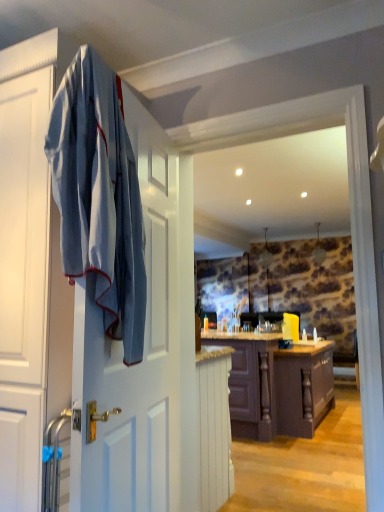
The height and width of the screenshot is (512, 384). Describe the element at coordinates (276, 386) in the screenshot. I see `dark wood cabinet at center, the second cabinetry positioned from the left` at that location.

Image resolution: width=384 pixels, height=512 pixels. What do you see at coordinates (214, 426) in the screenshot?
I see `white painted wood cabinet at lower center, arranged as the 2th cabinetry when viewed from the right` at bounding box center [214, 426].

Locate an element on the screen. This screenshot has height=512, width=384. blue cotton bath towel at left is located at coordinates (99, 196).

Looking at this image, considering the sizes of blue cotton bath towel at left and dark wood cabinet at center, the second cabinetry positioned from the left, in the image, is blue cotton bath towel at left bigger or smaller than dark wood cabinet at center, the second cabinetry positioned from the left,?

In the image, blue cotton bath towel at left appears to be smaller than dark wood cabinet at center, the second cabinetry positioned from the left.

From the image's perspective, count 2nd cabinetrys downward from the blue cotton bath towel at left and point to it. Please provide its 2D coordinates.

[(276, 386)]

How distant is blue cotton bath towel at left from dark wood cabinet at center, the 1th cabinetry in the back-to-front sequence?

The distance of blue cotton bath towel at left from dark wood cabinet at center, the 1th cabinetry in the back-to-front sequence, is 9.47 feet.

From a real-world perspective, who is located lower, blue cotton bath towel at left or dark wood cabinet at center, the second cabinetry positioned from the left?

In real-world perspective, dark wood cabinet at center, the second cabinetry positioned from the left, is lower.

From a real-world perspective, is dark wood cabinet at center, the 1th cabinetry when ordered from right to left, physically located above or below white painted wood cabinet at lower center, arranged as the 2th cabinetry when viewed from the right?

From a real-world perspective, dark wood cabinet at center, the 1th cabinetry when ordered from right to left, is physically above white painted wood cabinet at lower center, arranged as the 2th cabinetry when viewed from the right.

Between dark wood cabinet at center, the 1th cabinetry in the back-to-front sequence, and white painted wood cabinet at lower center, the 1th cabinetry from the front, which one has smaller width?

white painted wood cabinet at lower center, the 1th cabinetry from the front, is thinner.

Is dark wood cabinet at center, the 1th cabinetry when ordered from right to left, not close to white painted wood cabinet at lower center, arranged as the 2th cabinetry when viewed from the right?

Yes.

Where is `cabinetry on the left of dark wood cabinet at center, the 1th cabinetry when ordered from right to left`? cabinetry on the left of dark wood cabinet at center, the 1th cabinetry when ordered from right to left is located at coordinates (214, 426).

You are a GUI agent. You are given a task and a screenshot of the screen. Output one action in this format:
    pyautogui.click(x=<x>, y=<y>)
    Task: Click on the bath towel to the left of dark wood cabinet at center, marked as the 2th cabinetry in a front-to-back arrangement
    This screenshot has width=384, height=512.
    Given the screenshot: What is the action you would take?
    pyautogui.click(x=99, y=196)

Considering the sizes of dark wood cabinet at center, marked as the 2th cabinetry in a front-to-back arrangement, and blue cotton bath towel at left in the image, is dark wood cabinet at center, marked as the 2th cabinetry in a front-to-back arrangement, wider or thinner than blue cotton bath towel at left?

In the image, dark wood cabinet at center, marked as the 2th cabinetry in a front-to-back arrangement, appears to be wider than blue cotton bath towel at left.

Is white painted wood cabinet at lower center, the first cabinetry when ordered from left to right, not close to blue cotton bath towel at left?

Indeed, white painted wood cabinet at lower center, the first cabinetry when ordered from left to right, is not near blue cotton bath towel at left.

You are a GUI agent. You are given a task and a screenshot of the screen. Output one action in this format:
    pyautogui.click(x=<x>, y=<y>)
    Task: Click on the 1st cabinetry behind the blue cotton bath towel at left
    Image resolution: width=384 pixels, height=512 pixels.
    Given the screenshot: What is the action you would take?
    pyautogui.click(x=214, y=426)

Between white painted wood cabinet at lower center, the 1th cabinetry from the front, and blue cotton bath towel at left, which one has smaller width?

With smaller width is white painted wood cabinet at lower center, the 1th cabinetry from the front.

Is blue cotton bath towel at left at the back of white painted wood cabinet at lower center, arranged as the 2th cabinetry when viewed from the back?

No.

Is white painted wood cabinet at lower center, the first cabinetry when ordered from left to right, positioned with its back to dark wood cabinet at center, the 1th cabinetry in the back-to-front sequence?

white painted wood cabinet at lower center, the first cabinetry when ordered from left to right, is not turned away from dark wood cabinet at center, the 1th cabinetry in the back-to-front sequence.

You are a GUI agent. You are given a task and a screenshot of the screen. Output one action in this format:
    pyautogui.click(x=<x>, y=<y>)
    Task: Click on the cabinetry above the dark wood cabinet at center, the 1th cabinetry in the back-to-front sequence (from the image's perspective)
    
    Given the screenshot: What is the action you would take?
    pyautogui.click(x=214, y=426)

Can you confirm if white painted wood cabinet at lower center, the first cabinetry when ordered from left to right, is shorter than dark wood cabinet at center, the second cabinetry positioned from the left?

Correct, white painted wood cabinet at lower center, the first cabinetry when ordered from left to right, is not as tall as dark wood cabinet at center, the second cabinetry positioned from the left.

How different are the orientations of white painted wood cabinet at lower center, arranged as the 2th cabinetry when viewed from the back, and dark wood cabinet at center, the 1th cabinetry when ordered from right to left, in degrees?

0.555 degrees separate the facing orientations of white painted wood cabinet at lower center, arranged as the 2th cabinetry when viewed from the back, and dark wood cabinet at center, the 1th cabinetry when ordered from right to left.

Is blue cotton bath towel at left aimed at white painted wood cabinet at lower center, the first cabinetry when ordered from left to right?

No, blue cotton bath towel at left is not aimed at white painted wood cabinet at lower center, the first cabinetry when ordered from left to right.

Is point (58, 131) closer or farther from the camera than point (213, 434)?

Point (58, 131).

Which object is wider, blue cotton bath towel at left or white painted wood cabinet at lower center, arranged as the 2th cabinetry when viewed from the back?

blue cotton bath towel at left is wider.

Is blue cotton bath towel at left far away from white painted wood cabinet at lower center, the 1th cabinetry from the front?

Absolutely, blue cotton bath towel at left is distant from white painted wood cabinet at lower center, the 1th cabinetry from the front.

Identify the location of the 2nd cabinetry behind the blue cotton bath towel at left. (276, 386).

At what (x,y) coordinates should I click in order to perform the action: click on cabinetry lying below the white painted wood cabinet at lower center, arranged as the 2th cabinetry when viewed from the back (from the image's perspective). Please return your answer as a coordinate pair (x, y). The image size is (384, 512). Looking at the image, I should click on (276, 386).

When comparing their distances from white painted wood cabinet at lower center, arranged as the 2th cabinetry when viewed from the right, does blue cotton bath towel at left or dark wood cabinet at center, the 1th cabinetry in the back-to-front sequence, seem further?

Based on the image, blue cotton bath towel at left appears to be further to white painted wood cabinet at lower center, arranged as the 2th cabinetry when viewed from the right.

Looking at the image, which one is located further to blue cotton bath towel at left, white painted wood cabinet at lower center, the first cabinetry when ordered from left to right, or dark wood cabinet at center, the second cabinetry positioned from the left?

dark wood cabinet at center, the second cabinetry positioned from the left.

Which object lies further to the anchor point dark wood cabinet at center, marked as the 2th cabinetry in a front-to-back arrangement, blue cotton bath towel at left or white painted wood cabinet at lower center, the first cabinetry when ordered from left to right?

blue cotton bath towel at left.

Based on their spatial positions, is white painted wood cabinet at lower center, arranged as the 2th cabinetry when viewed from the back, or blue cotton bath towel at left closer to dark wood cabinet at center, the 1th cabinetry in the back-to-front sequence?

white painted wood cabinet at lower center, arranged as the 2th cabinetry when viewed from the back, lies closer to dark wood cabinet at center, the 1th cabinetry in the back-to-front sequence, than the other object.

Estimate the real-world distances between objects in this image. Which object is further from blue cotton bath towel at left, dark wood cabinet at center, the 1th cabinetry in the back-to-front sequence, or white painted wood cabinet at lower center, the 1th cabinetry from the front?

dark wood cabinet at center, the 1th cabinetry in the back-to-front sequence, lies further to blue cotton bath towel at left than the other object.

Considering their positions, is dark wood cabinet at center, the second cabinetry positioned from the left, positioned further to white painted wood cabinet at lower center, arranged as the 2th cabinetry when viewed from the right, than blue cotton bath towel at left?

Based on the image, blue cotton bath towel at left appears to be further to white painted wood cabinet at lower center, arranged as the 2th cabinetry when viewed from the right.

Locate an element on the screen. cabinetry located between blue cotton bath towel at left and dark wood cabinet at center, the 1th cabinetry when ordered from right to left, in the depth direction is located at coordinates (214, 426).